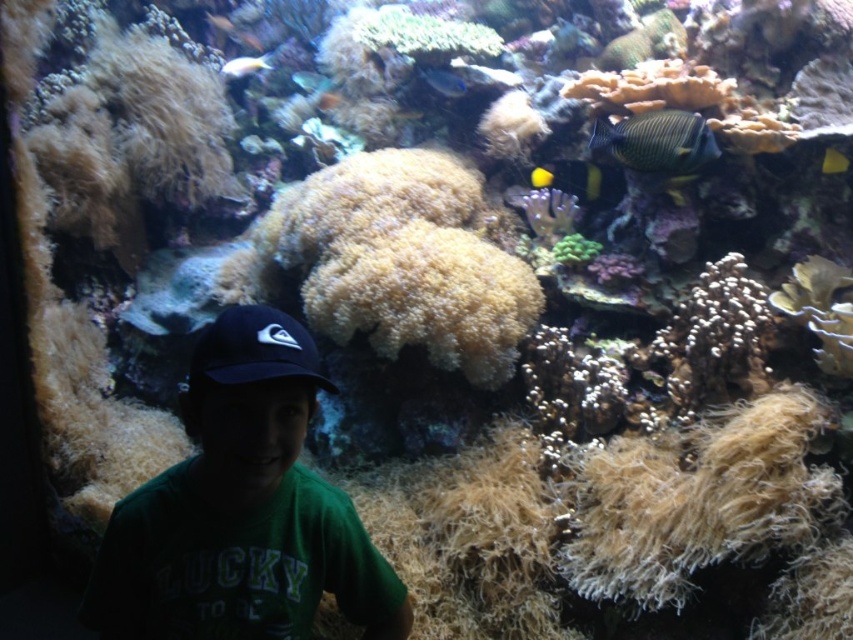
Question: Which object is the closest to the shiny blue fish at upper center?

Choices:
 (A) blue glossy fish at upper center
 (B) soft yellow coral at center

Answer: (A)

Question: Which point is closer to the camera?

Choices:
 (A) shiny blue fish at upper right
 (B) soft yellow coral at center
 (C) black fabric baseball cap at lower left

Answer: (C)

Question: Can you confirm if soft yellow coral at center is positioned to the right of shiny blue fish at upper right?

Choices:
 (A) yes
 (B) no

Answer: (B)

Question: Which of the following is the farthest from the observer?

Choices:
 (A) (445, 74)
 (B) (840, 161)

Answer: (A)

Question: From the image, what is the correct spatial relationship of white soft coral at upper center in relation to yellow-green textured fish at upper center?

Choices:
 (A) above
 (B) below

Answer: (B)

Question: Is yellow matte fish at center behind shiny silver fish at upper left?

Choices:
 (A) yes
 (B) no

Answer: (B)